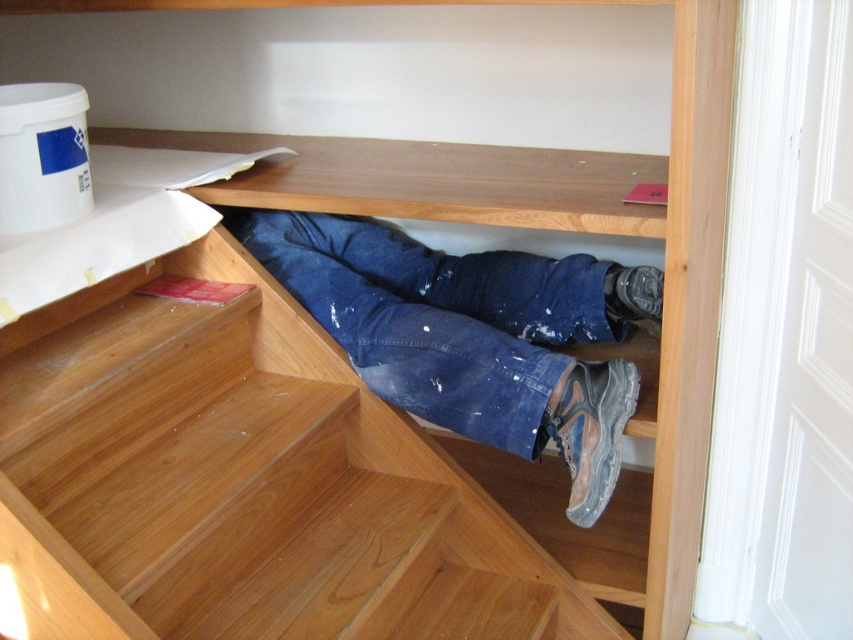
You are standing on the landing area and want to move to the next floor. The wooden stairs at center and blue jeans at center are in your path. Which object should you step over to continue upwards?

You should step over the blue jeans at center because the wooden stairs at center are below them, so stepping on the stairs would allow you to move upwards while avoiding the jeans.

You are standing at the bottom of the staircase and want to reach the landing area. According to the image, where are the wooden stairs at center positioned relative to your current location?

The wooden stairs at center are positioned at point (x=241, y=484), which means they are ahead and to the right of your current position at the bottom of the staircase.